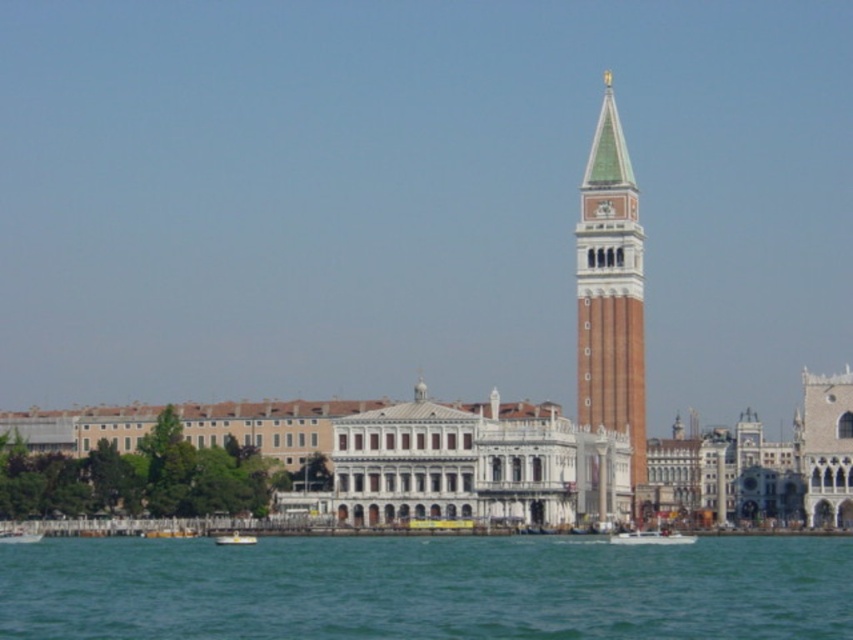
Question: In this image, where is blue water at lower center located relative to white plastic boat at lower left?

Choices:
 (A) right
 (B) left

Answer: (A)

Question: Is brick tower at center thinner than white plastic boat at lower left?

Choices:
 (A) no
 (B) yes

Answer: (A)

Question: Estimate the real-world distances between objects in this image. Which object is farther from the white plastic boat at lower center?

Choices:
 (A) brick tower at center
 (B) white plastic boat at lower left
 (C) blue water at lower center

Answer: (A)

Question: Estimate the real-world distances between objects in this image. Which object is closer to the white plastic boat at lower left?

Choices:
 (A) blue water at lower center
 (B) brick tower at center

Answer: (A)

Question: Which of the following is the farthest from the observer?

Choices:
 (A) (590, 179)
 (B) (231, 541)
 (C) (785, 600)

Answer: (A)

Question: Can you confirm if brick tower at center is wider than white plastic boat at lower left?

Choices:
 (A) yes
 (B) no

Answer: (A)